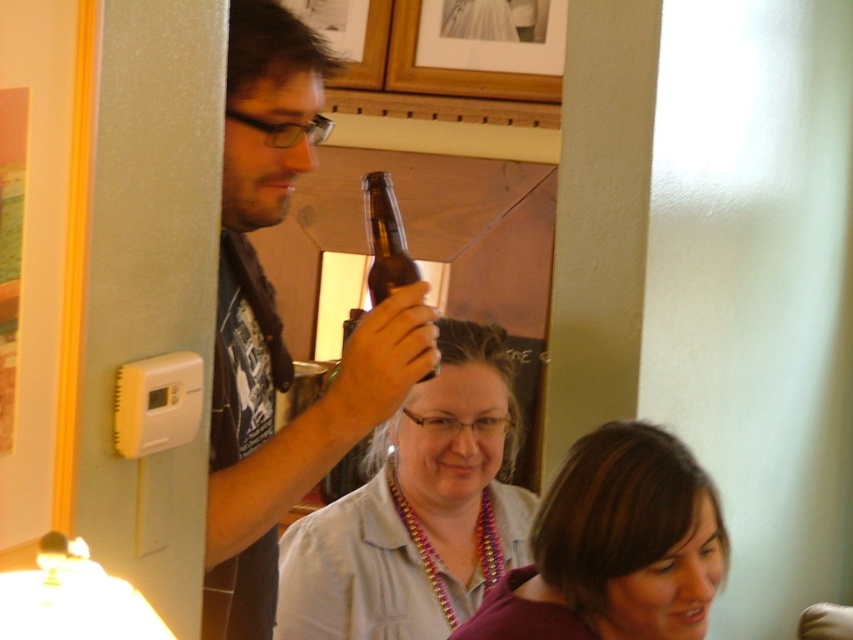
You are standing at the center of the room and want to hand a drink to the person wearing the matte black shirt at upper left. Based on their position, in which general direction should you move to approach them?

The matte black shirt at upper left is located at point 0.509 on the x and 0.329 on the y axis. Since you are at the center, you should move towards the upper left direction to reach them.

You are standing in the room and want to place a small plant between the two points, point [556,609] and point [379,176]. Which point should the plant be closer to in order to be placed closer to the camera?

The plant should be placed closer to point [379,176] because it is closer to the camera than point [556,609].

You are trying to identify the clothing items in the image. According to the scene, which clothing item is located above the other between the matte black shirt at upper left and the purple beaded necklace at center?

The matte black shirt at upper left is positioned over purple beaded necklace at center, so it is located above the purple beaded necklace at center.